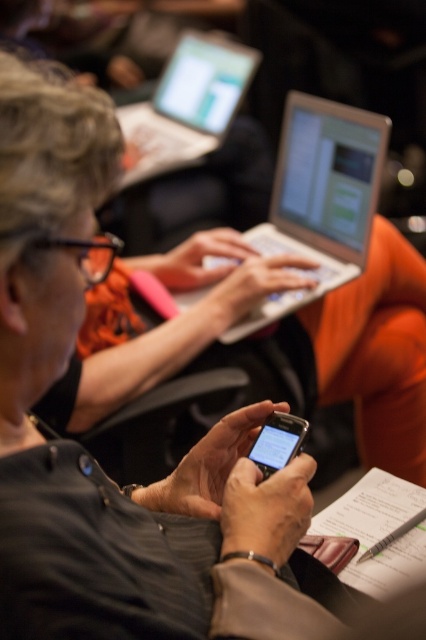
Between silver metallic laptop at center and silver metallic laptop at upper center, which one is positioned lower?

silver metallic laptop at center is lower down.

Is silver metallic laptop at center positioned in front of silver metallic laptop at upper center?

Yes.

Is point (319, 109) positioned behind point (189, 129)?

No, it is in front of (189, 129).

Identify the location of silver metallic laptop at center. This screenshot has height=640, width=426. (319, 198).

Which is behind, point (264, 321) or point (253, 454)?

Positioned behind is point (264, 321).

The image size is (426, 640). What do you see at coordinates (319, 198) in the screenshot?
I see `silver metallic laptop at center` at bounding box center [319, 198].

Who is more forward, (x=324, y=100) or (x=284, y=465)?

Point (x=284, y=465) is more forward.

Identify the location of silver metallic laptop at center. This screenshot has height=640, width=426. (319, 198).

Can you confirm if silver metallic laptop at upper center is positioned to the left of matte black smartphone at center?

Yes, silver metallic laptop at upper center is to the left of matte black smartphone at center.

Does silver metallic laptop at upper center appear on the right side of matte black smartphone at center?

In fact, silver metallic laptop at upper center is to the left of matte black smartphone at center.

Image resolution: width=426 pixels, height=640 pixels. Find the location of `silver metallic laptop at upper center`. silver metallic laptop at upper center is located at coordinates (187, 106).